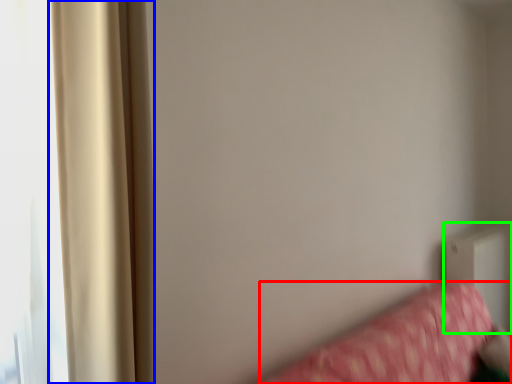
Question: Considering the real-world distances, which object is closest to furniture (highlighted by a red box)? curtain (highlighted by a blue box) or radiator (highlighted by a green box).

Choices:
 (A) curtain
 (B) radiator

Answer: (B)